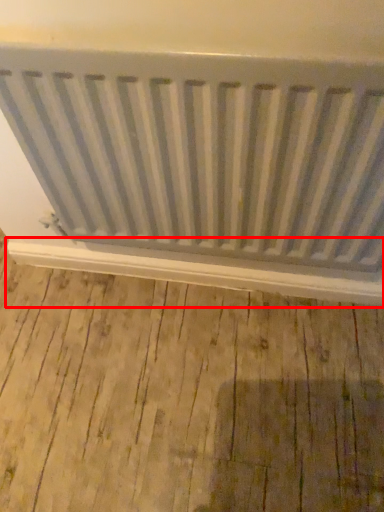
Question: Considering the relative positions of window sill (annotated by the red box) and radiator in the image provided, where is window sill (annotated by the red box) located with respect to the staircase?

Choices:
 (A) right
 (B) left

Answer: (B)